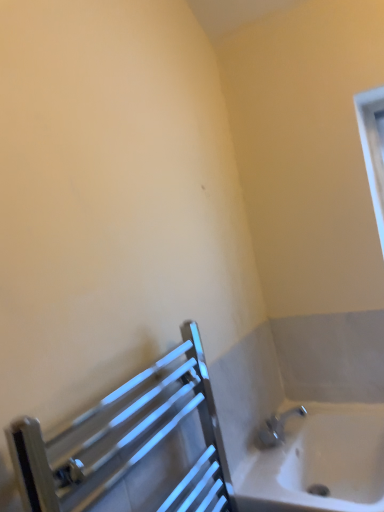
Question: Which is correct: white glossy bathtub at lower right is inside polished chrome towel rail at lower left, or outside of it?

Choices:
 (A) outside
 (B) inside

Answer: (A)

Question: From a real-world perspective, is white glossy bathtub at lower right above or below polished chrome towel rail at lower left?

Choices:
 (A) above
 (B) below

Answer: (B)

Question: In terms of width, does white glossy bathtub at lower right look wider or thinner when compared to polished chrome towel rail at lower left?

Choices:
 (A) thin
 (B) wide

Answer: (B)

Question: In the image, is polished chrome towel rail at lower left positioned in front of or behind white glossy bathtub at lower right?

Choices:
 (A) behind
 (B) front

Answer: (B)

Question: From a real-world perspective, relative to white glossy bathtub at lower right, is polished chrome towel rail at lower left vertically above or below?

Choices:
 (A) below
 (B) above

Answer: (B)

Question: Looking at their shapes, would you say polished chrome towel rail at lower left is wider or thinner than white glossy bathtub at lower right?

Choices:
 (A) wide
 (B) thin

Answer: (B)

Question: Is polished chrome towel rail at lower left spatially inside white glossy bathtub at lower right, or outside of it?

Choices:
 (A) inside
 (B) outside

Answer: (B)